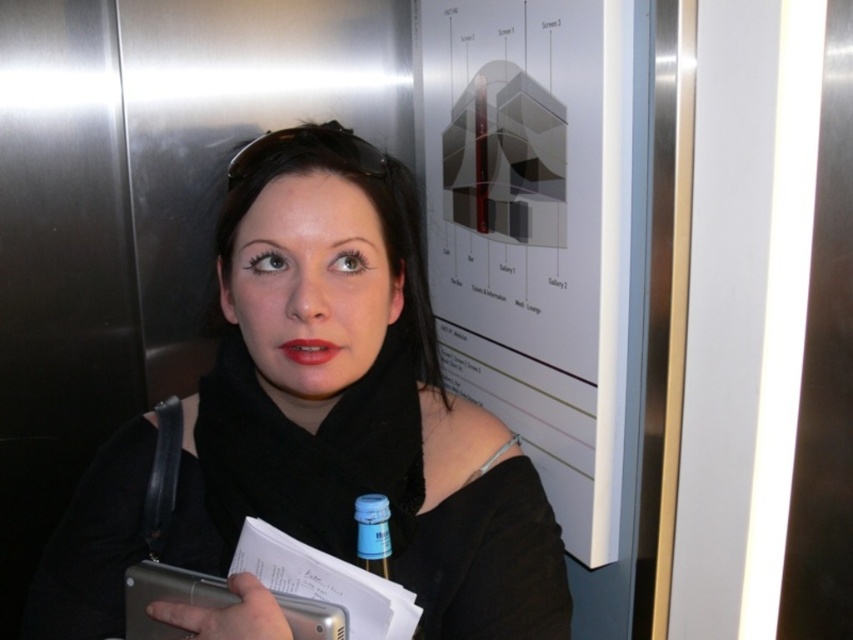
Question: Does black matte scarf at center appear under matte red lipstick at center?

Choices:
 (A) no
 (B) yes

Answer: (B)

Question: Is blue plastic bottle at center above matte red lipstick at center?

Choices:
 (A) yes
 (B) no

Answer: (B)

Question: Does blue plastic bottle at center appear on the right side of matte red lipstick at center?

Choices:
 (A) yes
 (B) no

Answer: (A)

Question: Considering the real-world distances, which object is closest to the black matte scarf at center?

Choices:
 (A) matte red lipstick at center
 (B) blue plastic bottle at center

Answer: (B)

Question: Which object is the farthest from the matte red lipstick at center?

Choices:
 (A) black matte scarf at center
 (B) blue plastic bottle at center

Answer: (A)

Question: Which point is closer to the camera?

Choices:
 (A) black matte scarf at center
 (B) blue plastic bottle at center

Answer: (A)